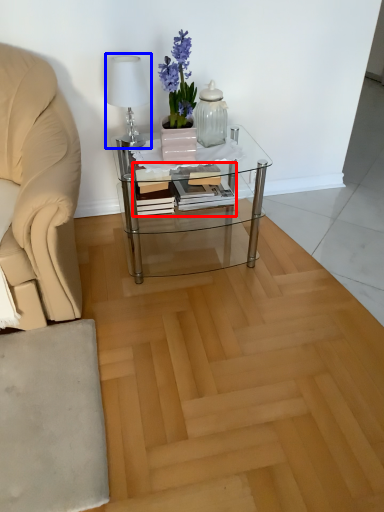
Question: Which object is closer to the camera taking this photo, book (highlighted by a red box) or table lamp (highlighted by a blue box)?

Choices:
 (A) book
 (B) table lamp

Answer: (B)